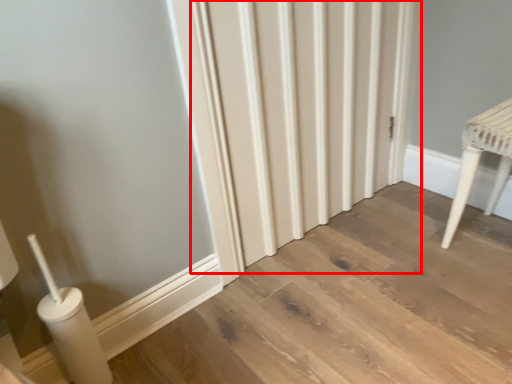
Question: From the image's perspective, where is radiator (annotated by the red box) located relative to furniture?

Choices:
 (A) below
 (B) above

Answer: (B)